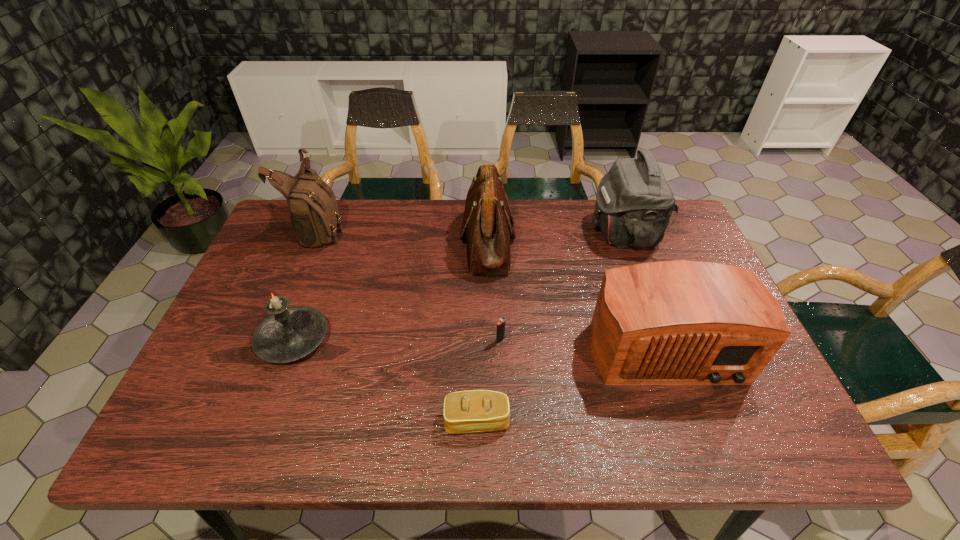
The image size is (960, 540). Identify the location of the leftmost shoulder bag. (314, 214).

This screenshot has width=960, height=540. What are the coordinates of `the rightmost shoulder bag` in the screenshot? It's located at (634, 203).

This screenshot has height=540, width=960. I want to click on the second shoulder bag from right to left, so click(x=487, y=226).

Identify the location of radio receiver. (682, 322).

At what (x,y) coordinates should I click in order to perform the action: click on the fifth tallest object. Please return your answer as a coordinate pair (x, y). Image resolution: width=960 pixels, height=540 pixels. Looking at the image, I should click on (289, 333).

What are the coordinates of `igniter` in the screenshot? It's located at (500, 334).

In order to click on the shortest object in this screenshot , I will do `click(468, 411)`.

Locate an element on the screen. The width and height of the screenshot is (960, 540). clutch bag is located at coordinates (468, 411).

Find the location of `blank area located on the front-facing side of the leftmost shoulder bag`. blank area located on the front-facing side of the leftmost shoulder bag is located at coordinates (456, 228).

Identify the location of free spot located on the open flap of the rightmost shoulder bag. (535, 233).